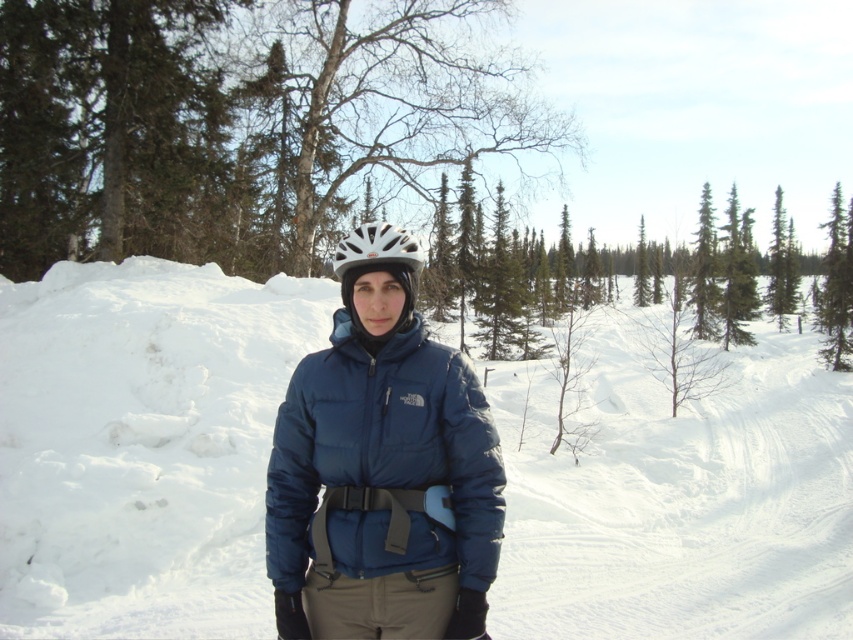
Measure the distance between white matte helmet at center and camera.

They are 8.40 feet apart.

Based on the photo, is white matte helmet at center behind white matte bicycle helmet at center?

No, white matte helmet at center is closer to the viewer.

Where is `white matte helmet at center`? white matte helmet at center is located at coordinates (374, 257).

The width and height of the screenshot is (853, 640). Find the location of `white matte helmet at center`. white matte helmet at center is located at coordinates (374, 257).

Does matte blue jacket at center have a greater height compared to white matte helmet at center?

Indeed, matte blue jacket at center has a greater height compared to white matte helmet at center.

Is point (500, 435) positioned in front of point (376, 225)?

No, (500, 435) is behind (376, 225).

The image size is (853, 640). In order to click on matte blue jacket at center in this screenshot , I will do `click(142, 445)`.

Which is below, navy blue down jacket at center or white matte bicycle helmet at center?

Positioned lower is navy blue down jacket at center.

Can you confirm if navy blue down jacket at center is positioned above white matte bicycle helmet at center?

Incorrect, navy blue down jacket at center is not positioned above white matte bicycle helmet at center.

What do you see at coordinates (384, 458) in the screenshot?
I see `navy blue down jacket at center` at bounding box center [384, 458].

Find the location of a particular element. navy blue down jacket at center is located at coordinates (384, 458).